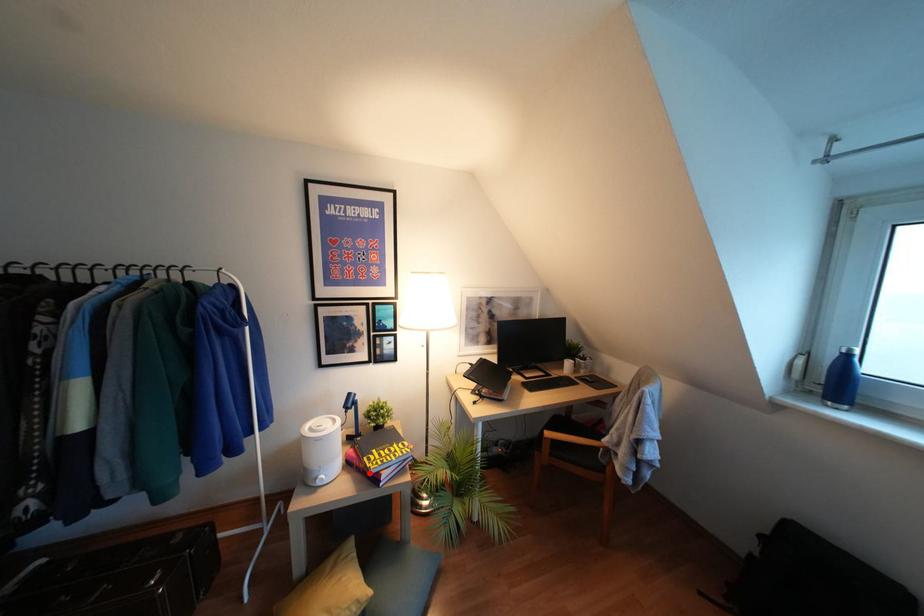
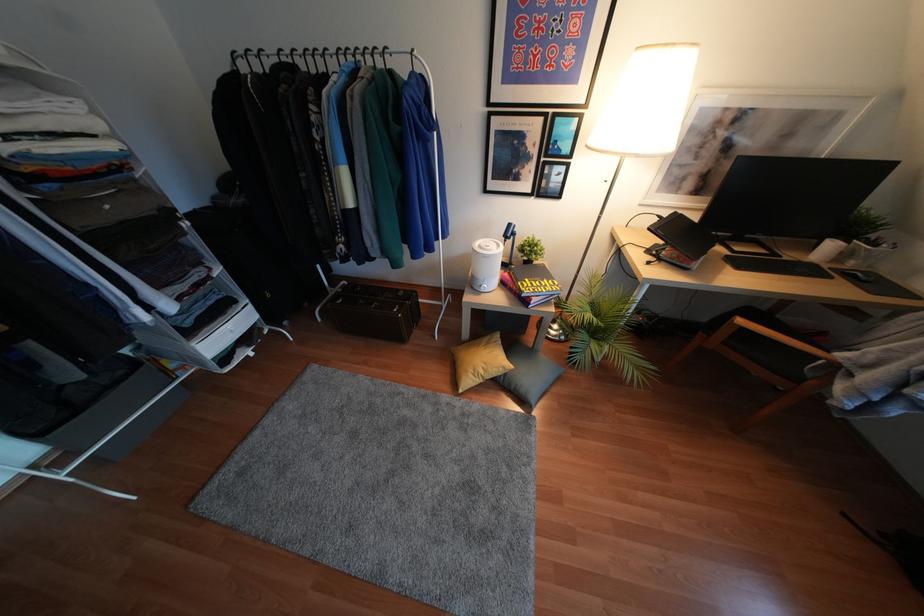
Question: I am providing you with two images of the same scene from different viewpoints. Image1 has a red point marked. In image2, the corresponding 3D location appears at what relative position? Reply with the corresponding letter.

Choices:
 (A) Closer
 (B) Farther

Answer: (A)